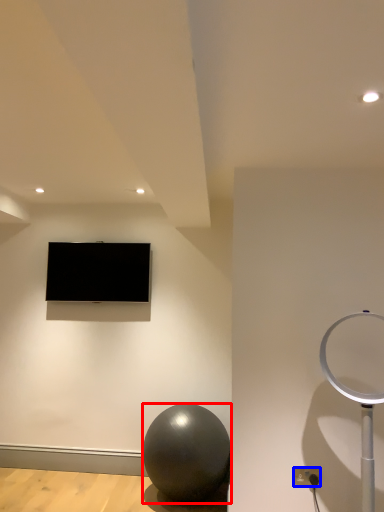
Question: Which of the following is the farthest to the observer, ball (highlighted by a red box) or electric outlet (highlighted by a blue box)?

Choices:
 (A) ball
 (B) electric outlet

Answer: (A)